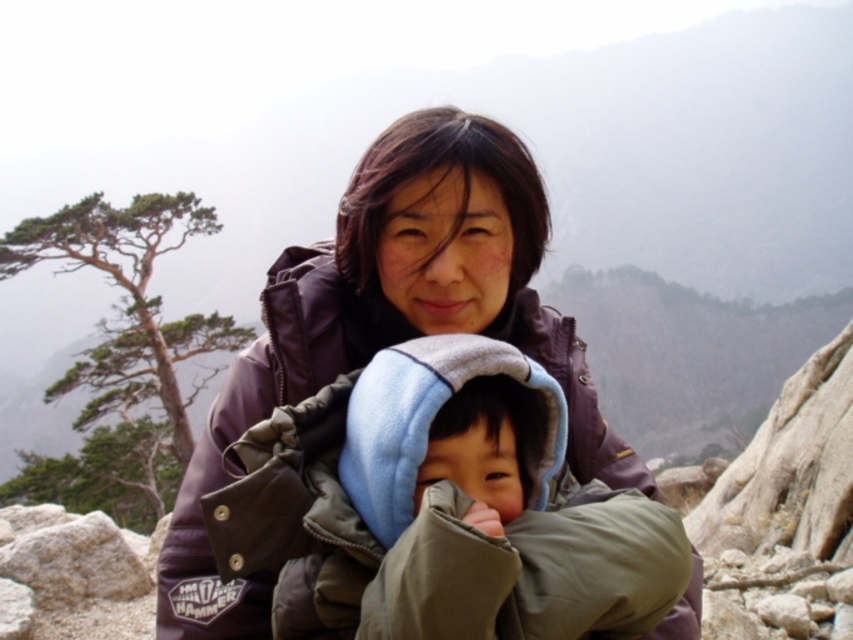
Question: Which object is closer to the camera taking this photo?

Choices:
 (A) matte purple jacket at center
 (B) light gray fleece jacket at center

Answer: (B)

Question: Which object appears farthest from the camera in this image?

Choices:
 (A) light gray fleece jacket at center
 (B) matte purple jacket at center

Answer: (B)

Question: Which of the following is the closest to the observer?

Choices:
 (A) light gray fleece jacket at center
 (B) matte purple jacket at center

Answer: (A)

Question: Can you confirm if light gray fleece jacket at center is thinner than matte purple jacket at center?

Choices:
 (A) yes
 (B) no

Answer: (A)

Question: Is light gray fleece jacket at center below matte purple jacket at center?

Choices:
 (A) no
 (B) yes

Answer: (B)

Question: Is light gray fleece jacket at center thinner than matte purple jacket at center?

Choices:
 (A) no
 (B) yes

Answer: (B)